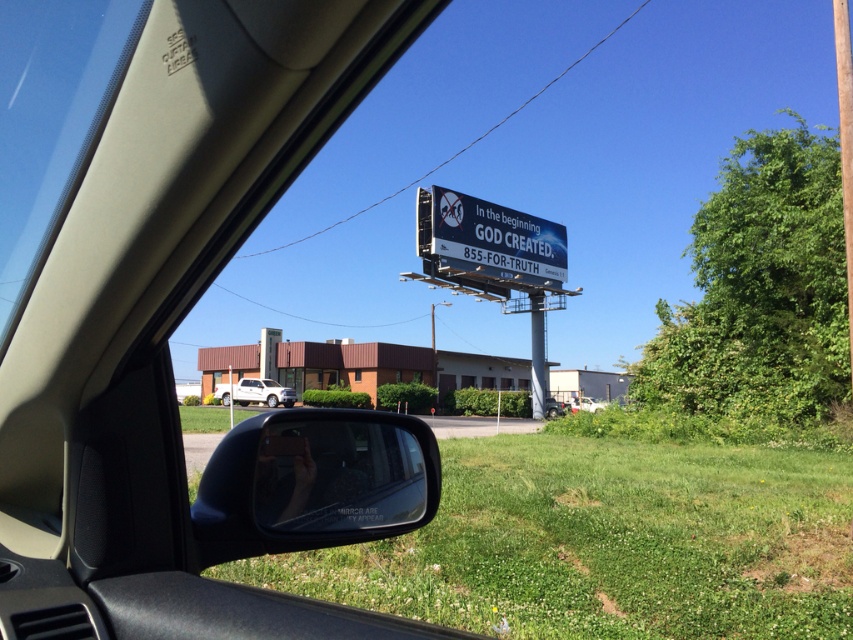
Is black glossy view mirror at lower center above white matte truck at center?

Yes, black glossy view mirror at lower center is above white matte truck at center.

Does black glossy view mirror at lower center appear under white matte truck at center?

No.

Between point (225, 529) and point (256, 390), which one is positioned behind?

Positioned behind is point (256, 390).

Where is `black glossy view mirror at lower center`? Image resolution: width=853 pixels, height=640 pixels. black glossy view mirror at lower center is located at coordinates (314, 483).

The width and height of the screenshot is (853, 640). I want to click on black glossy view mirror at lower center, so click(x=314, y=483).

Who is higher up, black glossy view mirror at lower center or white matte car at center?

black glossy view mirror at lower center

You are a GUI agent. You are given a task and a screenshot of the screen. Output one action in this format:
    pyautogui.click(x=<x>, y=<y>)
    Task: Click on the black glossy view mirror at lower center
    This screenshot has width=853, height=640.
    Given the screenshot: What is the action you would take?
    pyautogui.click(x=314, y=483)

Identify the location of black glossy view mirror at lower center. This screenshot has width=853, height=640. (314, 483).

Between white plastic billboard at upper center and white matte car at center, which one has less height?

white matte car at center is shorter.

Can you confirm if white plastic billboard at upper center is smaller than white matte car at center?

Yes, white plastic billboard at upper center is smaller than white matte car at center.

Which is behind, point (444, 250) or point (583, 396)?

Point (583, 396)

You are a GUI agent. You are given a task and a screenshot of the screen. Output one action in this format:
    pyautogui.click(x=<x>, y=<y>)
    Task: Click on the white plastic billboard at upper center
    Image resolution: width=853 pixels, height=640 pixels.
    Given the screenshot: What is the action you would take?
    pyautogui.click(x=496, y=236)